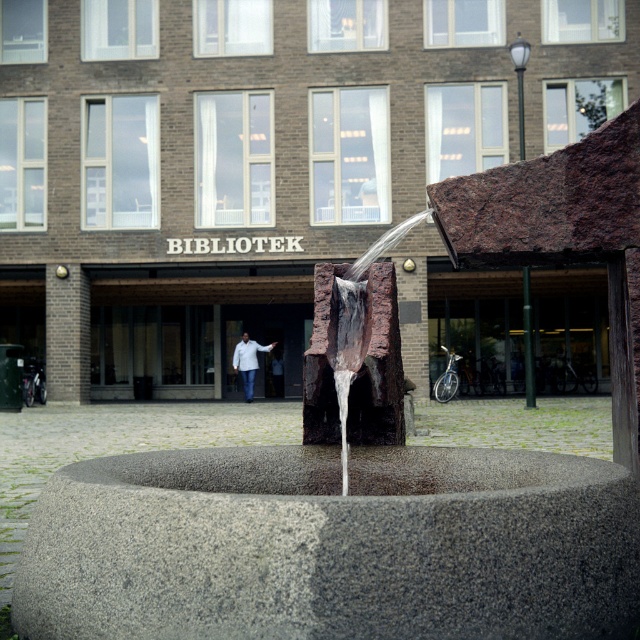
Question: Does clear water at center have a lesser width compared to white matte jacket at center?

Choices:
 (A) no
 (B) yes

Answer: (B)

Question: Which object is the closest to the white matte jacket at center?

Choices:
 (A) rustic stone fountain at center
 (B) clear water at center
 (C) granite water feature at center

Answer: (A)

Question: Where is gray granite water at center located in relation to rustic stone fountain at center in the image?

Choices:
 (A) left
 (B) right

Answer: (A)

Question: Can you confirm if gray granite water at center is positioned above rustic stone fountain at center?

Choices:
 (A) no
 (B) yes

Answer: (A)

Question: Considering the real-world distances, which object is closest to the clear water at center?

Choices:
 (A) gray granite water at center
 (B) rustic stone fountain at center

Answer: (A)

Question: Which of the following is the closest to the observer?

Choices:
 (A) (369, 289)
 (B) (541, 600)
 (C) (237, 365)
 (D) (342, 392)

Answer: (B)